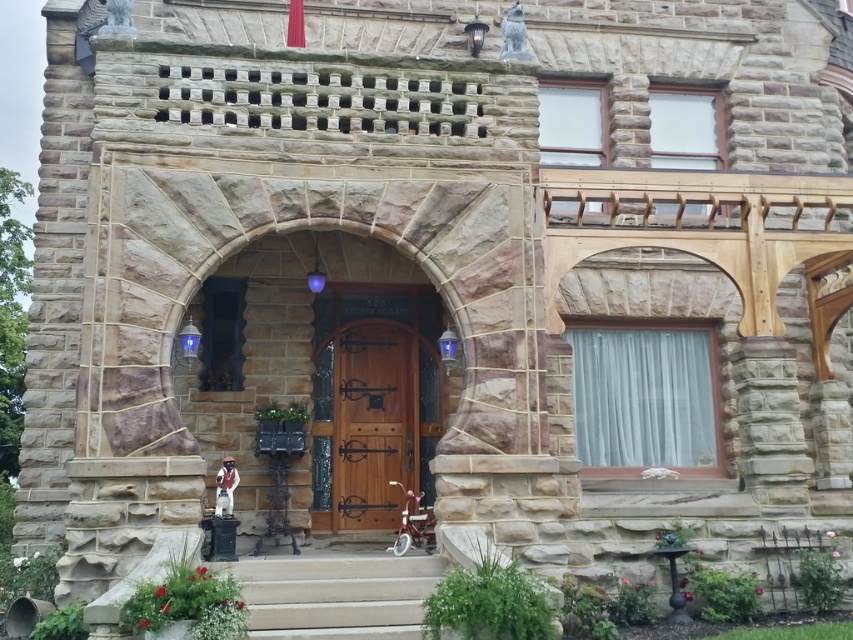
Is wooden door at center taller than smooth concrete stairs at lower center?

Correct, wooden door at center is much taller as smooth concrete stairs at lower center.

Does wooden door at center have a lesser height compared to smooth concrete stairs at lower center?

No, wooden door at center is not shorter than smooth concrete stairs at lower center.

Does point (331, 516) lie in front of point (259, 570)?

No, it is behind (259, 570).

This screenshot has height=640, width=853. I want to click on wooden door at center, so click(x=372, y=422).